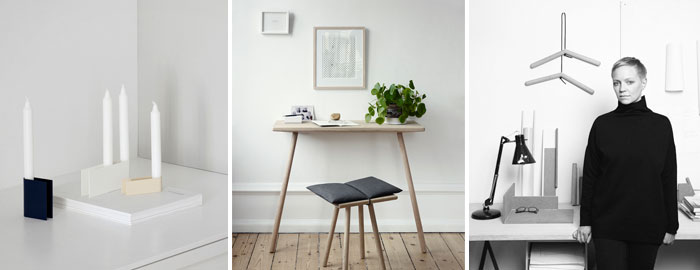
The height and width of the screenshot is (270, 700). I want to click on surface, so click(x=547, y=235), click(x=98, y=250), click(x=392, y=141).